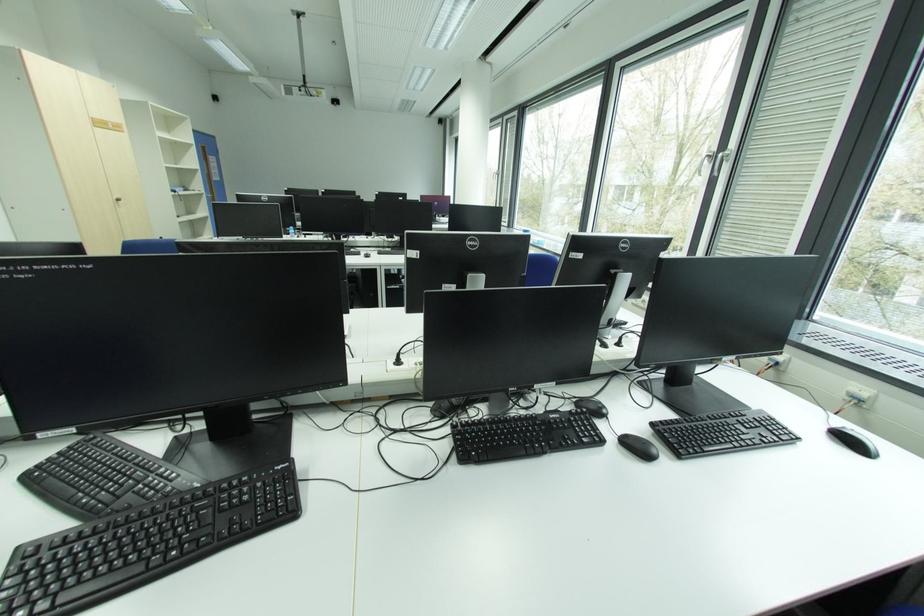
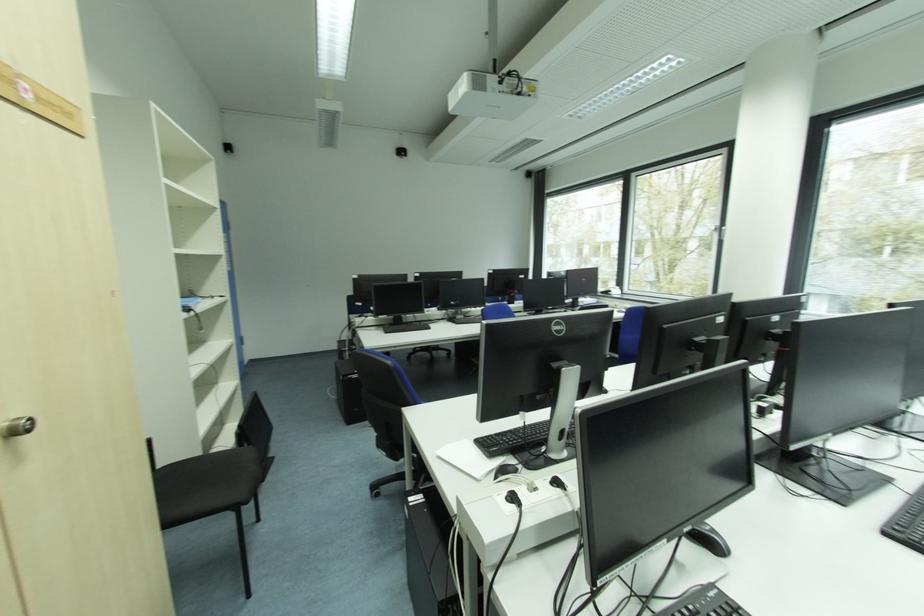
Where in the second image is the point corresponding to point 120,199 from the first image?

(6, 424)